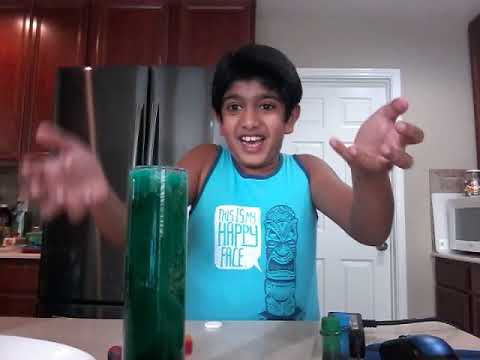
Identify the location of white door. (332, 111).